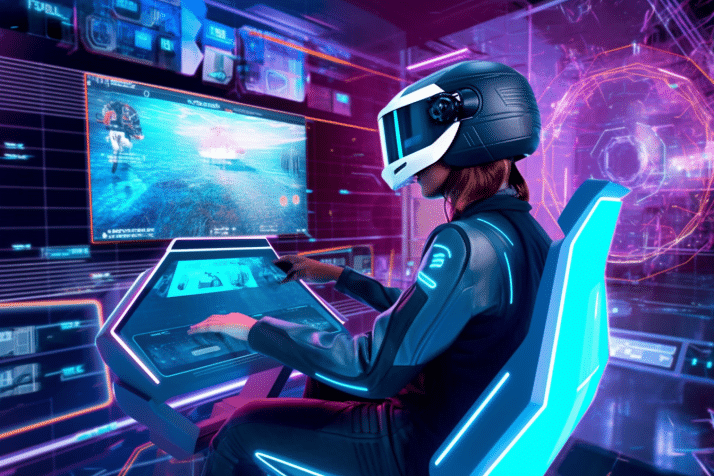
Where is `screen`? The height and width of the screenshot is (476, 714). screen is located at coordinates (159, 161).